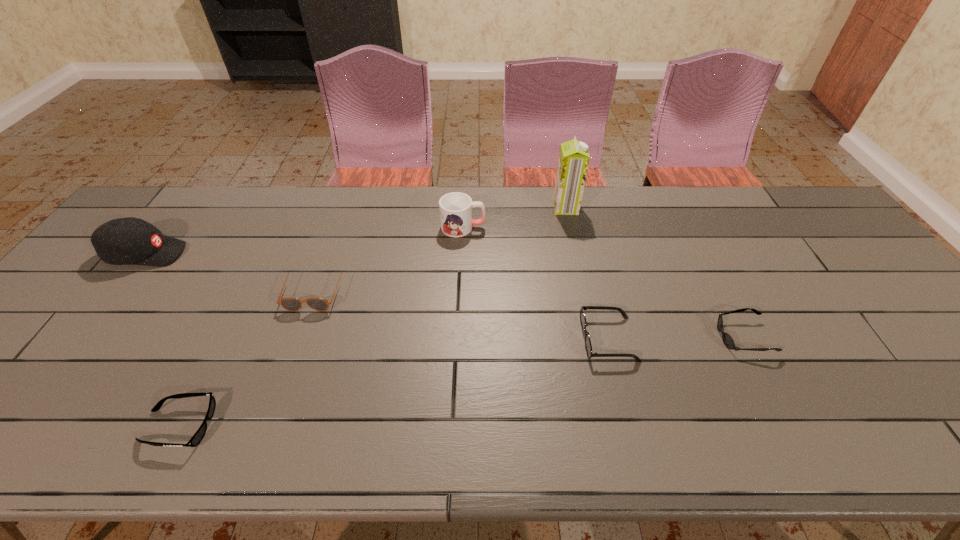
Locate an element on the screen. vacant region located 0.400m on the right of the farthest object is located at coordinates (700, 208).

Identify the location of free space located 0.200m with a logo on the front of the leftmost object. The image size is (960, 540). (252, 254).

You are a GUI agent. You are given a task and a screenshot of the screen. Output one action in this format:
    pyautogui.click(x=<x>, y=<y>)
    Task: Click on the vacant area situated on the side of the fourth object from right to left with the handle
    Image resolution: width=960 pixels, height=540 pixels.
    Given the screenshot: What is the action you would take?
    (x=614, y=227)

This screenshot has height=540, width=960. I want to click on vacant region located 0.370m on the front-facing side of the fifth object from right to left, so click(x=257, y=455).

Locate an element on the screen. The height and width of the screenshot is (540, 960). free region located on the front-facing side of the third sunglasses from left to right is located at coordinates (492, 339).

I want to click on blank space located 0.060m on the front-facing side of the third sunglasses from left to right, so click(557, 339).

Image resolution: width=960 pixels, height=540 pixels. Find the location of `free space located 0.320m on the front-facing side of the third sunglasses from left to right`. free space located 0.320m on the front-facing side of the third sunglasses from left to right is located at coordinates (450, 339).

Where is `vacant area situated 0.160m on the lenses of the rightmost object`? This screenshot has height=540, width=960. vacant area situated 0.160m on the lenses of the rightmost object is located at coordinates (653, 337).

The width and height of the screenshot is (960, 540). I want to click on free space located 0.290m on the lenses of the rightmost object, so click(x=600, y=337).

The image size is (960, 540). Identify the location of vacant space located 0.220m on the lenses of the rightmost object. (629, 337).